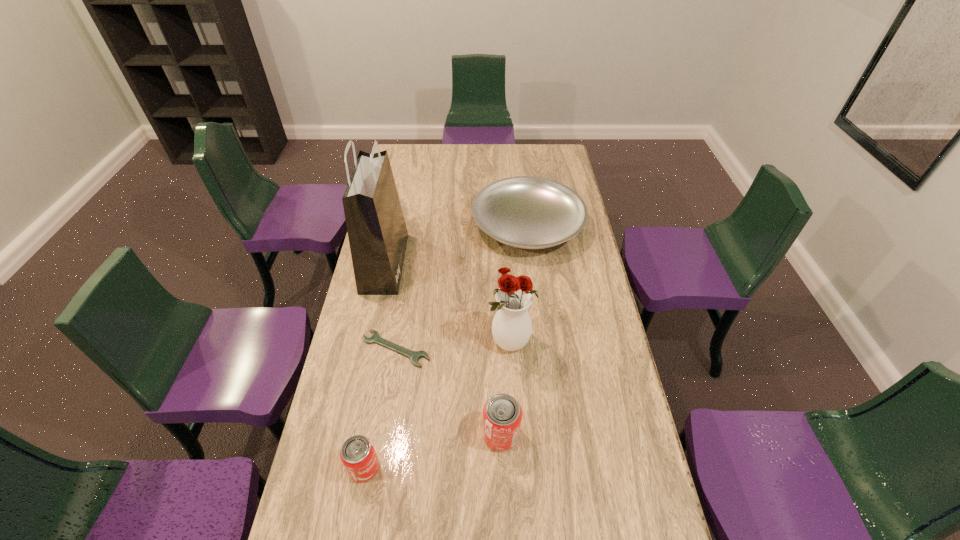
Please point a free position for a can on the right. Please provide its 2D coordinates. Your answer should be formatted as a tuple, i.e. [(x, y)], where the tuple contains the x and y coordinates of a point satisfying the conditions above.

[(624, 405)]